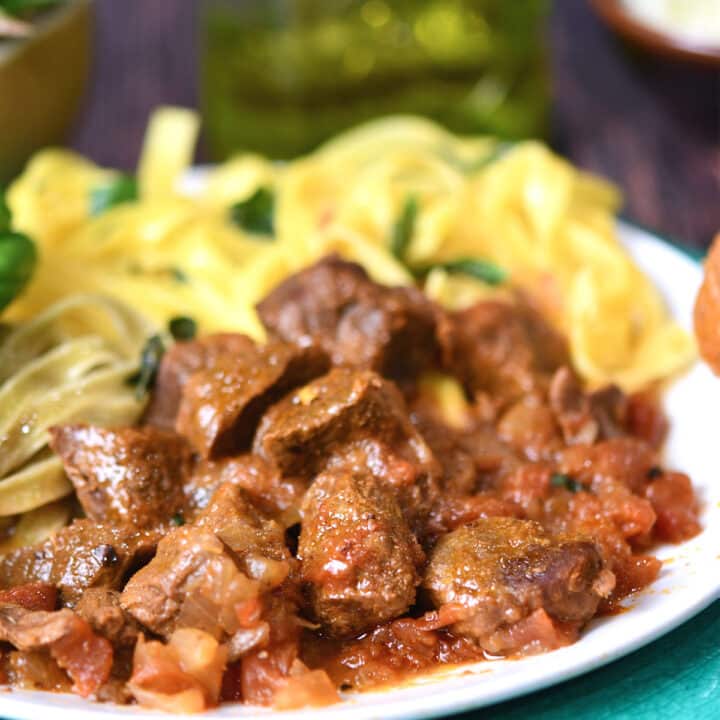
Find the location of a particular element. The width and height of the screenshot is (720, 720). red plate is located at coordinates (649, 36).